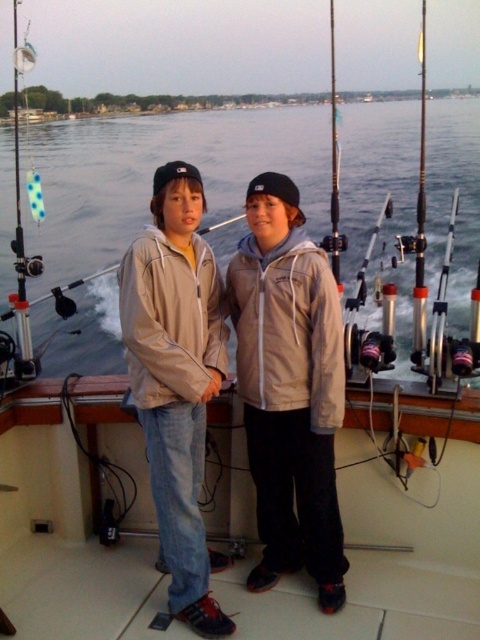
You are a photographer trying to capture the two people on the boat deck. The light beige jacket at center is an important subject. Given that the camera focuses on the point at coordinates point (x=178, y=378), will the person wearing the light beige jacket at center be in focus?

The light beige jacket at center is represented by point (x=178, y=378), so yes, the person wearing the light beige jacket at center will be in focus since the camera is focusing on that point.

You are a photographer trying to capture a clear shot of the light beige jacket at center without the clear water at center obstructing the view. Is this possible given their positions?

The light beige jacket at center is behind the clear water at center, so the clear water at center would obstruct the view of the light beige jacket at center. Therefore, it is not possible to capture a clear shot of the light beige jacket at center without the clear water at center obstructing the view.

You are a photographer trying to capture a clear shot of the light beige jacket at center and the metallic fishing pole at center. Which object should you focus on first if you want to ensure both are in focus without adjusting the camera settings?

The light beige jacket at center is not as tall as the metallic fishing pole at center, so you should focus on the metallic fishing pole at center first since it is taller and will require a closer focus point to ensure both are in focus.